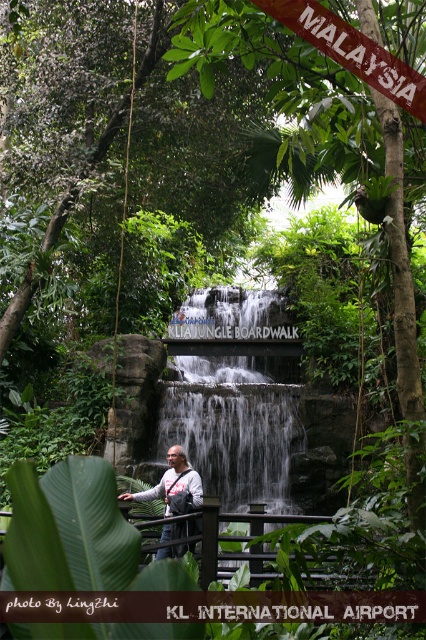
Question: Which point is closer to the camera taking this photo?

Choices:
 (A) (259, 448)
 (B) (135, 499)

Answer: (B)

Question: Can you confirm if white textured water at center is positioned below matte gray backpack at center?

Choices:
 (A) yes
 (B) no

Answer: (A)

Question: Is white textured water at center thinner than matte gray backpack at center?

Choices:
 (A) no
 (B) yes

Answer: (B)

Question: Does white textured water at center have a smaller size compared to matte gray backpack at center?

Choices:
 (A) no
 (B) yes

Answer: (B)